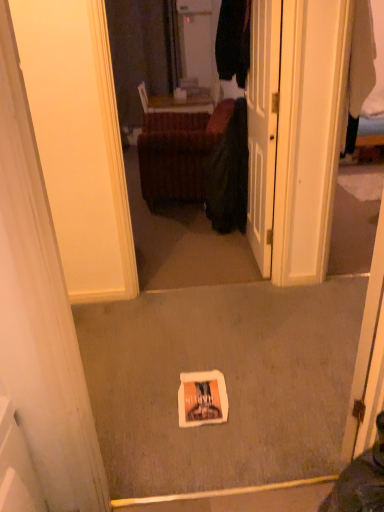
Where is `white glossy door at center`? This screenshot has height=512, width=384. white glossy door at center is located at coordinates (262, 126).

Does white glossy door at center have a lesser width compared to velvet brown ottoman at center?

Yes, white glossy door at center is thinner than velvet brown ottoman at center.

Are white glossy door at center and velvet brown ottoman at center beside each other?

No.

This screenshot has width=384, height=512. Find the location of `door to the right of velvet brown ottoman at center`. door to the right of velvet brown ottoman at center is located at coordinates (262, 126).

Is point (270, 180) closer or farther from the camera than point (230, 116)?

Point (270, 180) is positioned closer to the camera compared to point (230, 116).

Is velvet brown ottoman at center positioned far away from white glossy door at center?

Yes, velvet brown ottoman at center and white glossy door at center are quite far apart.

Can you confirm if velvet brown ottoman at center is thinner than white glossy door at center?

No, velvet brown ottoman at center is not thinner than white glossy door at center.

Between velvet brown ottoman at center and white glossy door at center, which one appears on the left side from the viewer's perspective?

Positioned to the left is velvet brown ottoman at center.

Who is shorter, velvet brown ottoman at center or white glossy door at center?

With less height is velvet brown ottoman at center.

Are velvet brown ottoman at center and dark green fabric at center located far from each other?

velvet brown ottoman at center is actually quite close to dark green fabric at center.

Does velvet brown ottoman at center turn towards dark green fabric at center?

Yes, velvet brown ottoman at center is turned towards dark green fabric at center.

Who is bigger, velvet brown ottoman at center or dark green fabric at center?

With larger size is velvet brown ottoman at center.

From the picture: Is velvet brown ottoman at center completely or partially outside of dark green fabric at center?

That's correct, velvet brown ottoman at center is outside of dark green fabric at center.

Which object is closer to the camera taking this photo, white glossy door at center or dark green fabric at center?

Positioned in front is white glossy door at center.

Is white glossy door at center facing towards dark green fabric at center?

No, white glossy door at center is not oriented towards dark green fabric at center.

Which object is wider, white glossy door at center or dark green fabric at center?

With larger width is dark green fabric at center.

Does white glossy door at center appear on the right side of dark green fabric at center?

Indeed, white glossy door at center is positioned on the right side of dark green fabric at center.

How many degrees apart are the facing directions of dark green fabric at center and white glossy door at center?

90 degrees separate the facing orientations of dark green fabric at center and white glossy door at center.

Is dark green fabric at center located outside white glossy door at center?

Yes, dark green fabric at center is located beyond the bounds of white glossy door at center.

Does dark green fabric at center have a lesser height compared to white glossy door at center?

Correct, dark green fabric at center is not as tall as white glossy door at center.

Is dark green fabric at center bigger or smaller than white glossy door at center?

In the image, dark green fabric at center appears to be larger than white glossy door at center.

Is dark green fabric at center beside velvet brown ottoman at center?

No, dark green fabric at center is not with velvet brown ottoman at center.

Does dark green fabric at center have a greater width compared to velvet brown ottoman at center?

No.

Does point (216, 164) appear closer or farther from the camera than point (161, 204)?

Point (216, 164) is positioned closer to the camera compared to point (161, 204).

You are a GUI agent. You are given a task and a screenshot of the screen. Output one action in this format:
    pyautogui.click(x=<x>, y=<y>)
    Task: Click on the furniture located on the left of dark green fabric at center
    Image resolution: width=384 pixels, height=512 pixels.
    Given the screenshot: What is the action you would take?
    pyautogui.click(x=178, y=153)

Find the location of a particular element. Image resolution: width=384 pixels, height=512 pixels. door below the velvet brown ottoman at center (from the image's perspective) is located at coordinates (262, 126).

The image size is (384, 512). I want to click on furniture lying on the left of white glossy door at center, so click(x=178, y=153).

Looking at the image, which one is located further to dark green fabric at center, white glossy door at center or velvet brown ottoman at center?

Based on the image, white glossy door at center appears to be further to dark green fabric at center.

From the image, which object appears to be farther from white glossy door at center, velvet brown ottoman at center or dark green fabric at center?

The object further to white glossy door at center is velvet brown ottoman at center.

Consider the image. Looking at the image, which one is located closer to velvet brown ottoman at center, dark green fabric at center or white glossy door at center?

The object closer to velvet brown ottoman at center is dark green fabric at center.

Based on their spatial positions, is velvet brown ottoman at center or white glossy door at center further from dark green fabric at center?

white glossy door at center is further to dark green fabric at center.

From the image, which object appears to be farther from white glossy door at center, dark green fabric at center or velvet brown ottoman at center?

The object further to white glossy door at center is velvet brown ottoman at center.

From the image, which object appears to be nearer to velvet brown ottoman at center, white glossy door at center or dark green fabric at center?

Based on the image, dark green fabric at center appears to be nearer to velvet brown ottoman at center.

The height and width of the screenshot is (512, 384). What are the coordinates of `clothing located between white glossy door at center and velvet brown ottoman at center in the depth direction` in the screenshot? It's located at (228, 175).